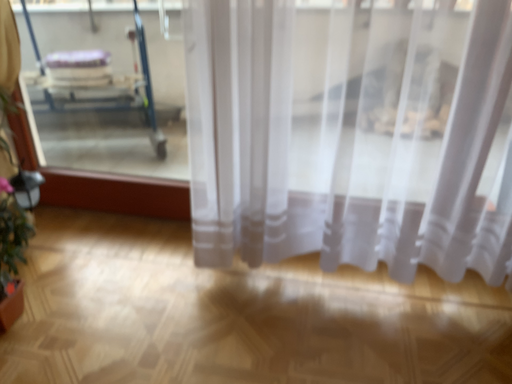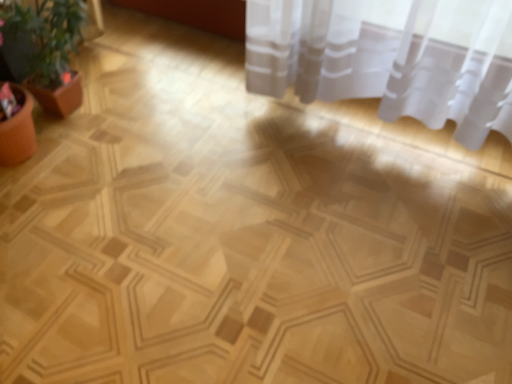
Question: How did the camera likely rotate when shooting the video?

Choices:
 (A) rotated left
 (B) rotated right

Answer: (A)